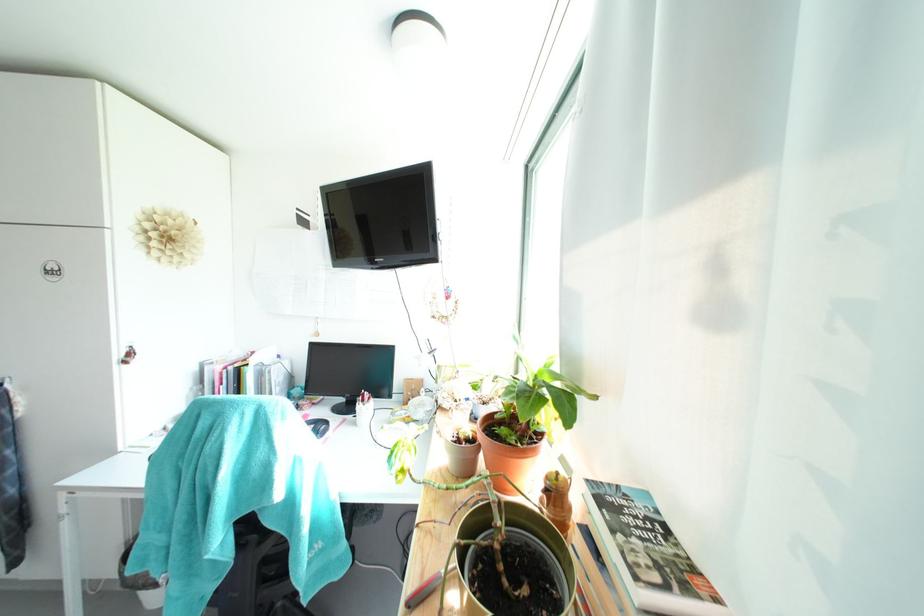
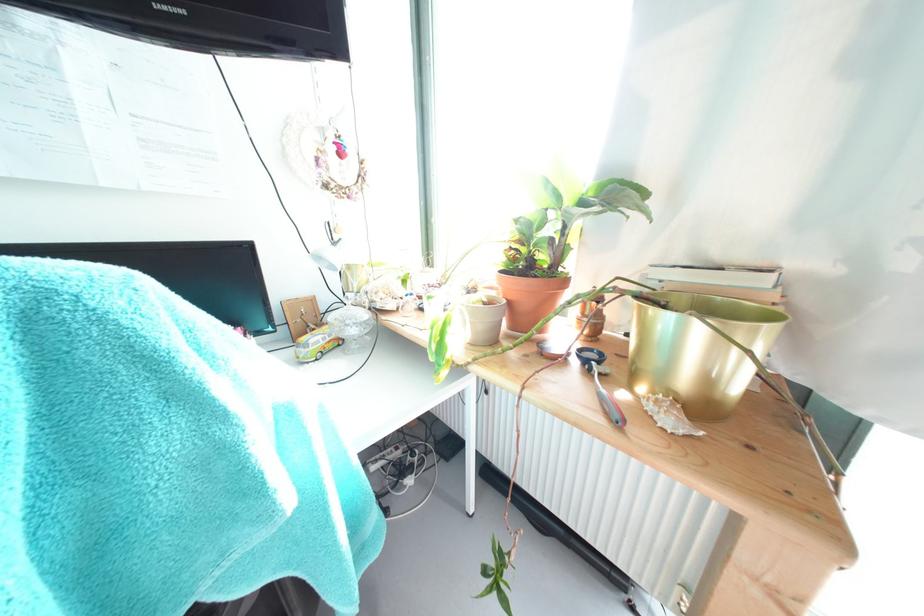
The point at (428, 416) is marked in the first image. Where is the corresponding point in the second image?

(359, 333)